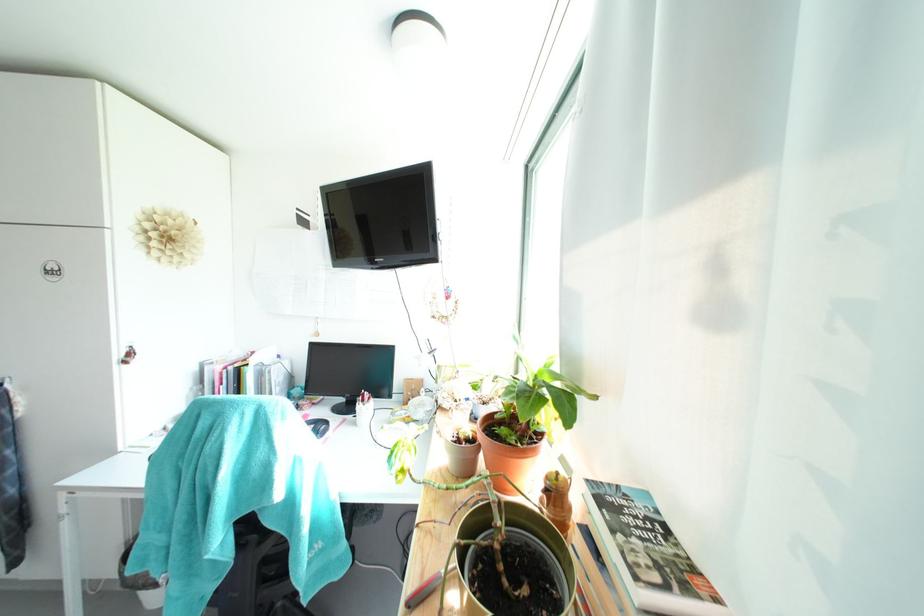
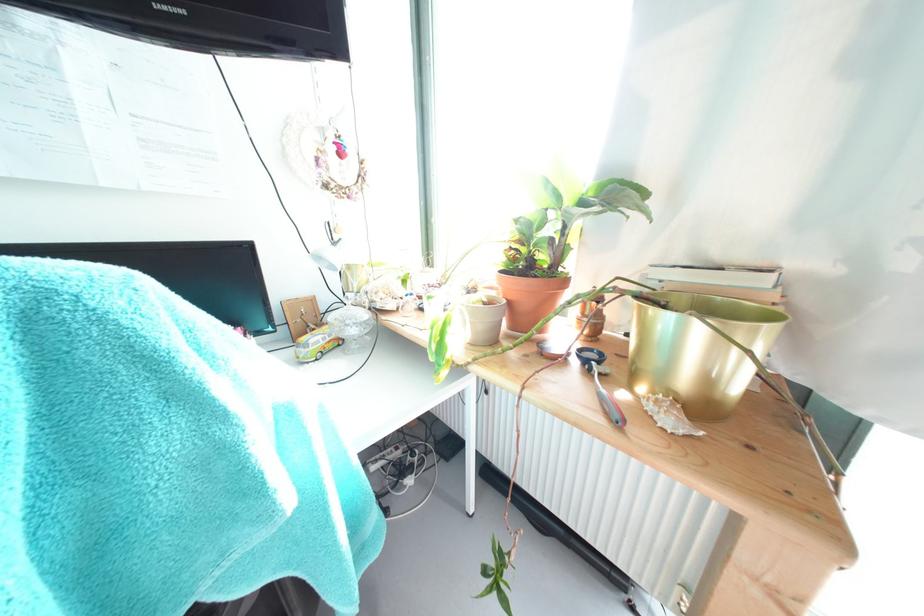
The point at (428, 416) is marked in the first image. Where is the corresponding point in the second image?

(359, 333)